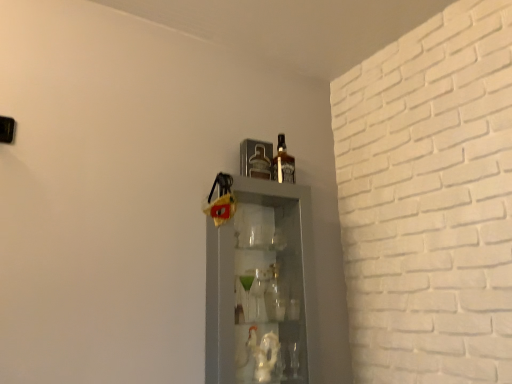
Question: Could you tell me if clear glass cabinet at center is facing brown glass bottle at upper center?

Choices:
 (A) yes
 (B) no

Answer: (B)

Question: Considering the relative sizes of clear glass cabinet at center and brown glass bottle at upper center in the image provided, is clear glass cabinet at center shorter than brown glass bottle at upper center?

Choices:
 (A) yes
 (B) no

Answer: (B)

Question: From a real-world perspective, is clear glass cabinet at center positioned under brown glass bottle at upper center based on gravity?

Choices:
 (A) yes
 (B) no

Answer: (A)

Question: Does clear glass cabinet at center lie in front of brown glass bottle at upper center?

Choices:
 (A) no
 (B) yes

Answer: (B)

Question: Are clear glass cabinet at center and brown glass bottle at upper center far apart?

Choices:
 (A) no
 (B) yes

Answer: (A)

Question: From the image's perspective, would you say clear glass cabinet at center is shown under brown glass bottle at upper center?

Choices:
 (A) no
 (B) yes

Answer: (B)

Question: Can you confirm if brown glass bottle at upper center is positioned to the left of clear glass cabinet at center?

Choices:
 (A) yes
 (B) no

Answer: (B)

Question: Is the position of brown glass bottle at upper center more distant than that of clear glass cabinet at center?

Choices:
 (A) no
 (B) yes

Answer: (B)

Question: From the image's perspective, is brown glass bottle at upper center located above clear glass cabinet at center?

Choices:
 (A) no
 (B) yes

Answer: (B)

Question: From a real-world perspective, does brown glass bottle at upper center stand above clear glass cabinet at center?

Choices:
 (A) no
 (B) yes

Answer: (B)

Question: Can you confirm if brown glass bottle at upper center is positioned to the right of clear glass cabinet at center?

Choices:
 (A) yes
 (B) no

Answer: (A)

Question: Is there a large distance between brown glass bottle at upper center and clear glass cabinet at center?

Choices:
 (A) no
 (B) yes

Answer: (A)

Question: From a real-world perspective, is brown glass bottle at upper center physically located above or below clear glass cabinet at center?

Choices:
 (A) below
 (B) above

Answer: (B)